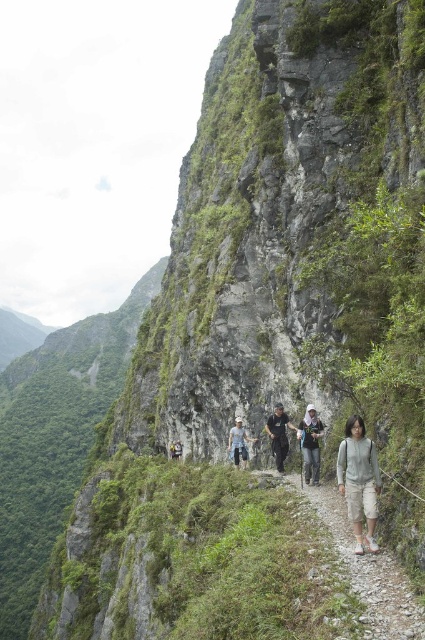
Question: Which of the following is the closest to the observer?

Choices:
 (A) light gray sweater at center
 (B) dusty gravel path at center

Answer: (B)

Question: Among these points, which one is farthest from the camera?

Choices:
 (A) (401, 573)
 (B) (234, 438)
 (C) (269, 417)
 (D) (350, 477)

Answer: (C)

Question: Is light brown fabric backpack at center below light blue denim pants at center?

Choices:
 (A) yes
 (B) no

Answer: (B)

Question: Which is nearer to the light gray sweater at center?

Choices:
 (A) black matte pants at center
 (B) light brown fabric backpack at center

Answer: (B)

Question: In this image, where is light gray sweater at center located relative to light blue denim pants at center?

Choices:
 (A) above
 (B) below

Answer: (A)

Question: Considering the relative positions of light gray sweater at center and light brown fabric backpack at center in the image provided, where is light gray sweater at center located with respect to light brown fabric backpack at center?

Choices:
 (A) right
 (B) left

Answer: (A)